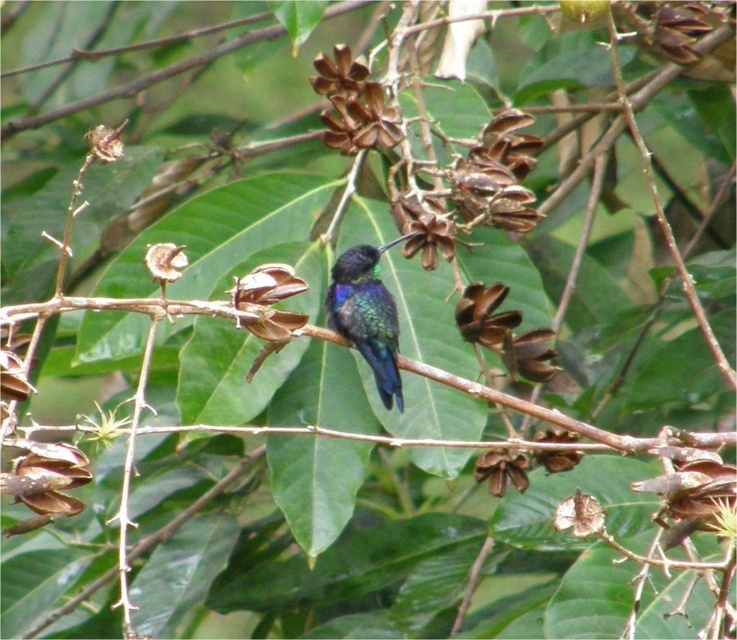
Question: Where is shiny iridescent bird at center located in relation to brown matte pod at upper center in the image?

Choices:
 (A) right
 (B) left

Answer: (A)

Question: Is brown matte pod at upper center positioned before smooth white seed pod at center?

Choices:
 (A) yes
 (B) no

Answer: (B)

Question: Which object is closer to the camera taking this photo?

Choices:
 (A) brown matte pod at upper center
 (B) shiny iridescent bird at center
 (C) greenish-brown dried pod at upper left
 (D) smooth white seed pod at center

Answer: (C)

Question: Among these objects, which one is farthest from the camera?

Choices:
 (A) greenish-brown dried pod at upper left
 (B) smooth white seed pod at center

Answer: (B)

Question: Is brown matte pod at upper center to the right of greenish-brown dried pod at upper left from the viewer's perspective?

Choices:
 (A) no
 (B) yes

Answer: (B)

Question: Which of these objects is positioned farthest from the greenish-brown dried pod at upper left?

Choices:
 (A) smooth white seed pod at center
 (B) shiny iridescent bird at center
 (C) brown matte pod at upper center

Answer: (C)